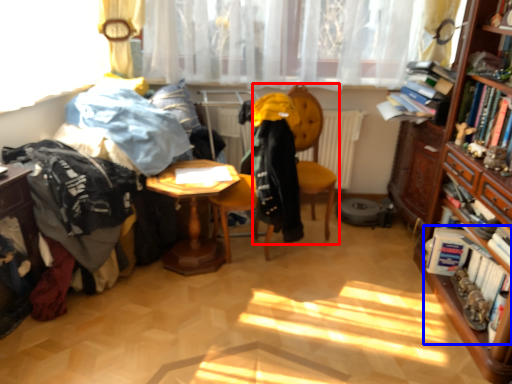
Question: Which of the following is the farthest to the observer, chair (highlighted by a red box) or book (highlighted by a blue box)?

Choices:
 (A) chair
 (B) book

Answer: (A)